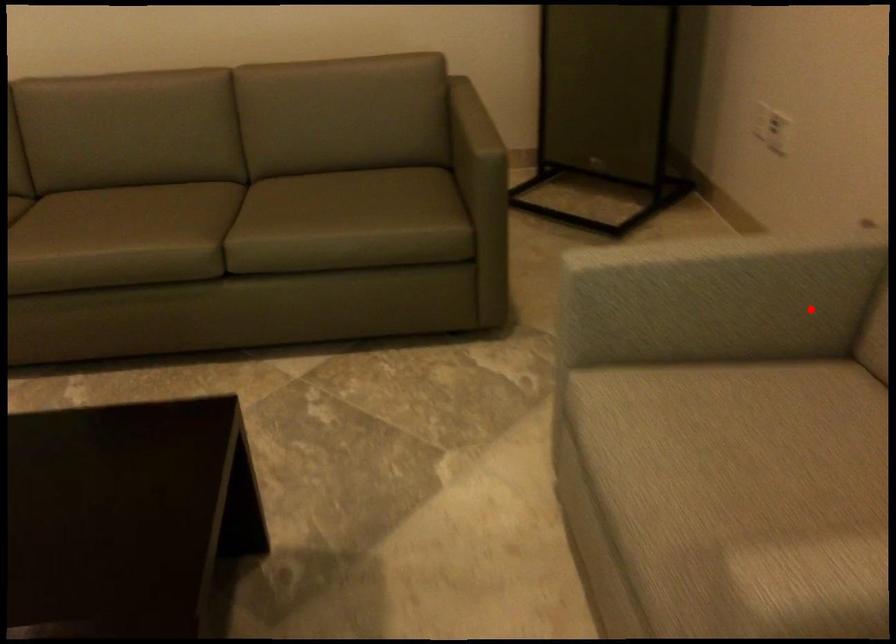
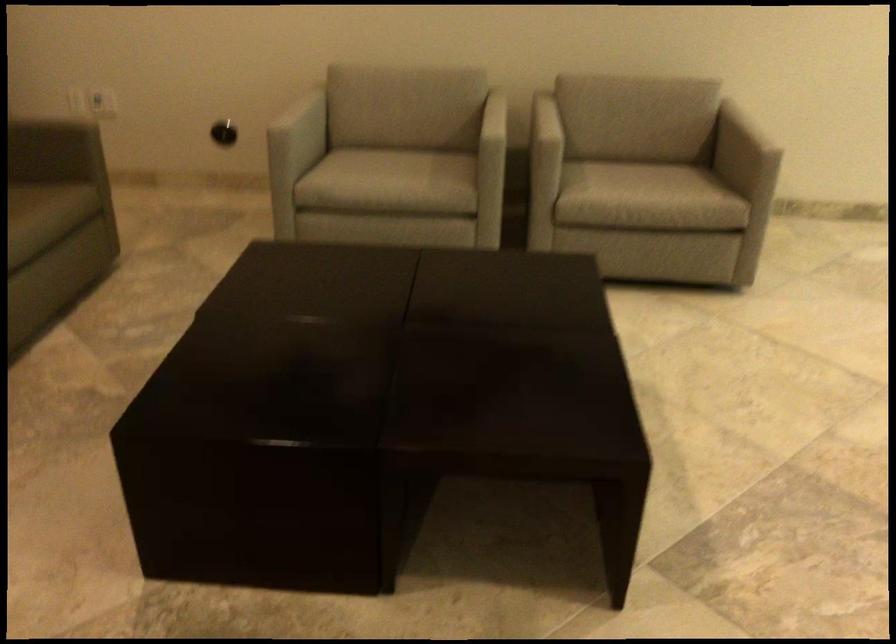
The point at the highlighted location is marked in the first image. Where is the corresponding point in the second image?

(304, 124)